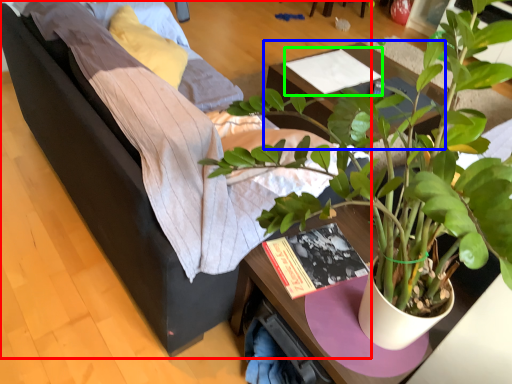
Question: Which object is the farthest from studio couch (highlighted by a red box)? Choose among these: table (highlighted by a blue box) or magazine (highlighted by a green box).

Choices:
 (A) table
 (B) magazine

Answer: (B)